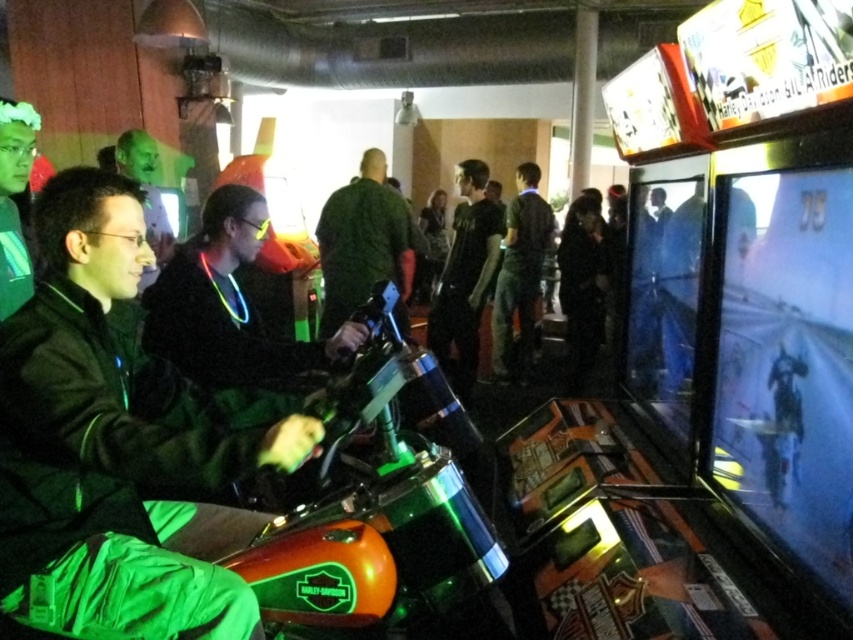
You are a tailor observing two shirts in an arcade scene. The green matte shirt at center and the black cotton shirt at center are both visible. Which shirt has a greater width?

The green matte shirt at center has a greater width than the black cotton shirt at center.

You are a photographer in the arcade scene. You notice a point at coordinates (465, 276). What object is this point located on?

The point at coordinates (465, 276) is located on the black cotton shirt at center.

You are a photographer trying to capture a clear photo of the black cotton shirt at center and the dark green shirt at center. Since both shirts are at the center, which one should you focus on to ensure the other is also in focus?

The black cotton shirt at center is in front of the dark green shirt at center. To ensure both are in focus, focus on the black cotton shirt at center since it is closer to the camera.